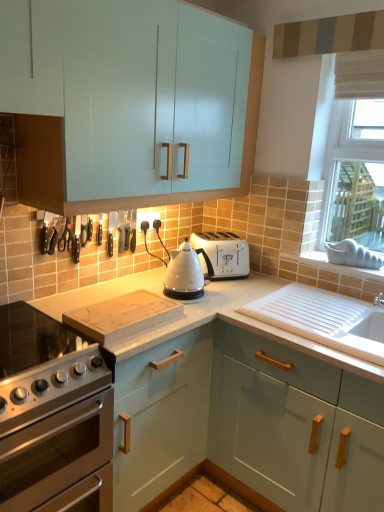
Identify the location of free space above satin silver gas stove at lower left (from a real-world perspective). Image resolution: width=384 pixels, height=512 pixels. (21, 331).